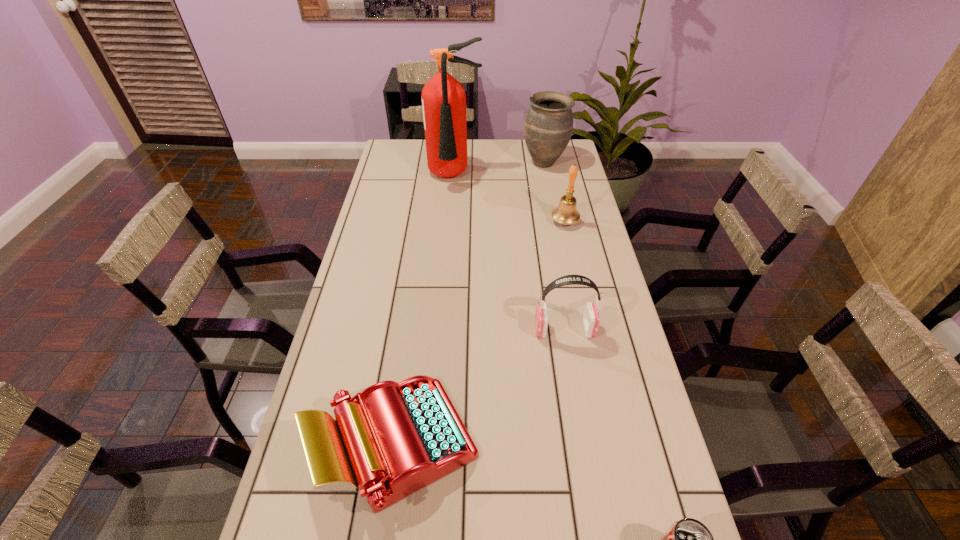
I want to click on object that is at the far right corner, so click(x=548, y=125).

Identify the location of free region at the far edge of the desktop. This screenshot has height=540, width=960. (495, 161).

Find the location of a particular element. The image size is (960, 540). vacant area at the left edge is located at coordinates (383, 305).

The image size is (960, 540). Find the location of `free location at the right edge of the desktop`. free location at the right edge of the desktop is located at coordinates (580, 200).

Where is `empty location between the fire extinguisher and the earphone`? This screenshot has width=960, height=540. empty location between the fire extinguisher and the earphone is located at coordinates (510, 253).

At what (x,y) coordinates should I click in order to perform the action: click on free space between the tallest object and the fifth farthest object. Please return your answer as a coordinate pair (x, y). This screenshot has width=960, height=540. Looking at the image, I should click on (426, 310).

Find the location of `empty space that is in between the tallest object and the fourth nearest object`. empty space that is in between the tallest object and the fourth nearest object is located at coordinates (510, 199).

This screenshot has width=960, height=540. What are the coordinates of `empty space that is in between the tallest object and the urn` in the screenshot? It's located at (499, 170).

The width and height of the screenshot is (960, 540). I want to click on free space between the urn and the bell, so click(x=555, y=192).

This screenshot has width=960, height=540. In order to click on unoccupied area between the fourth nearest object and the fire extinguisher in this screenshot , I will do `click(510, 199)`.